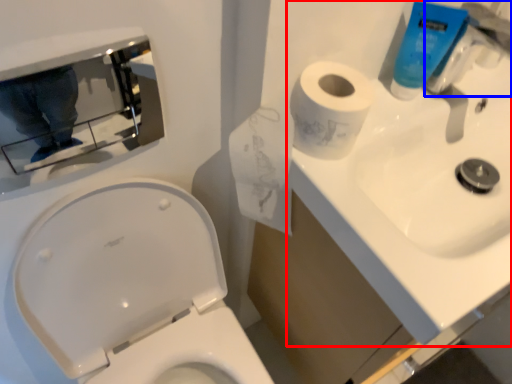
Question: Which point is further to the camera, sink (highlighted by a red box) or faucet (highlighted by a blue box)?

Choices:
 (A) sink
 (B) faucet

Answer: (B)